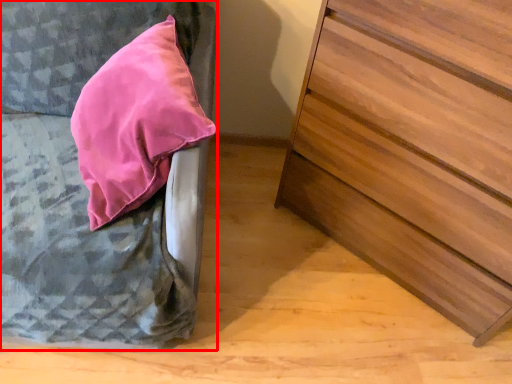
Question: From the image's perspective, what is the correct spatial relationship of furniture (annotated by the red box) in relation to chest of drawers?

Choices:
 (A) below
 (B) above

Answer: (B)